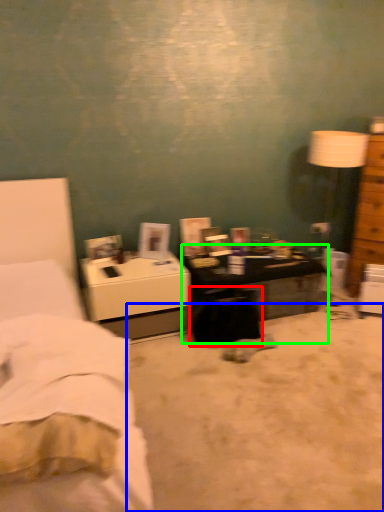
Question: Which object is positioned farthest from swivel chair (highlighted by a red box)? Select from plain (highlighted by a blue box) and desk (highlighted by a green box).

Choices:
 (A) plain
 (B) desk

Answer: (A)